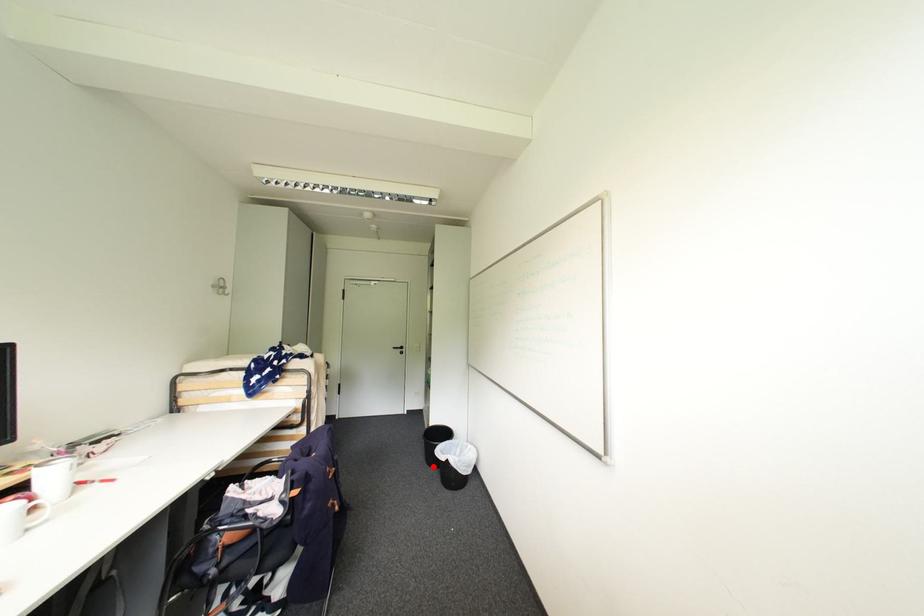
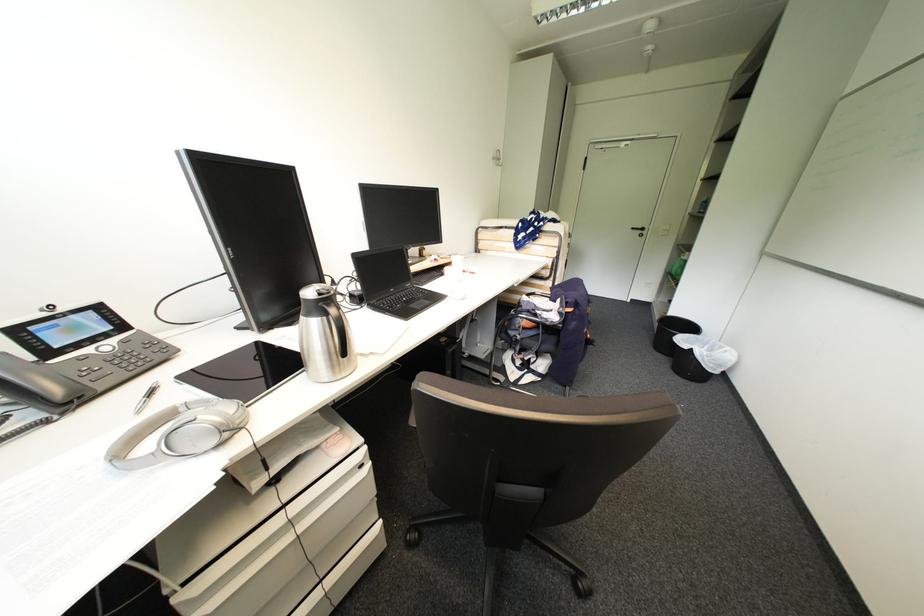
Locate, in the second image, the point that corresponds to the highlighted location in the first image.

(660, 351)